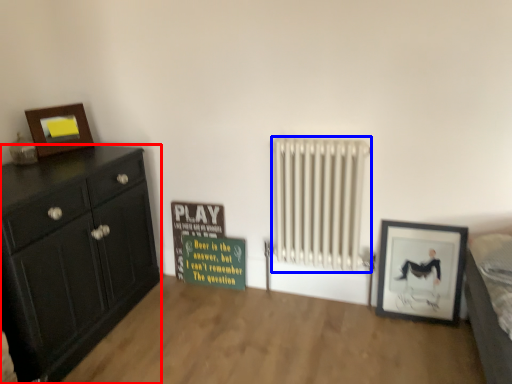
Question: Which of the following is the farthest to the observer, chest of drawers (highlighted by a red box) or radiator (highlighted by a blue box)?

Choices:
 (A) chest of drawers
 (B) radiator

Answer: (B)